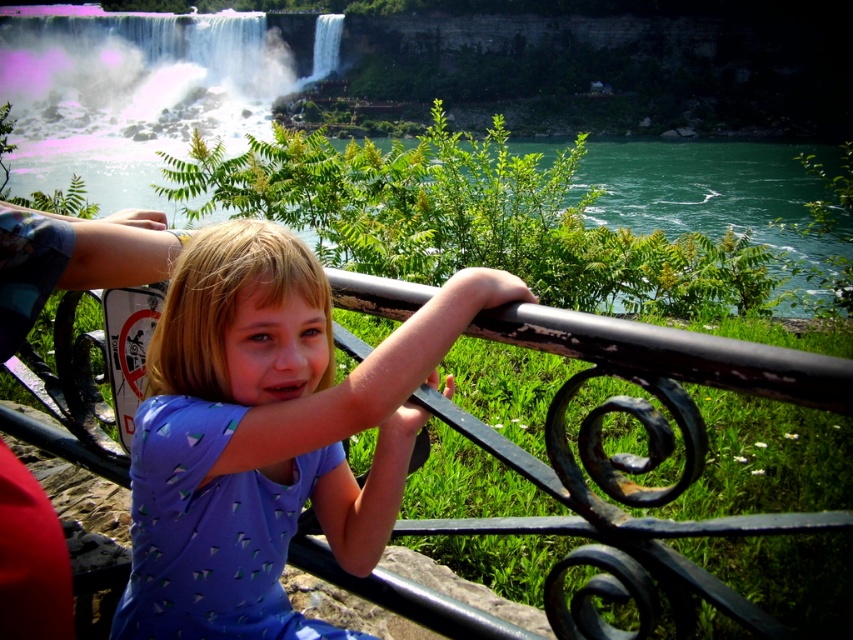
Which is more to the right, purple matte shirt at center or green water at upper center?

purple matte shirt at center

What do you see at coordinates (267, 433) in the screenshot?
I see `purple matte shirt at center` at bounding box center [267, 433].

Is point (204, 300) farther from viewer compared to point (585, 157)?

No, (204, 300) is closer to viewer.

Find the location of a particular element. purple matte shirt at center is located at coordinates (267, 433).

Locate an element on the screen. This screenshot has height=640, width=853. purple matte shirt at center is located at coordinates (267, 433).

Can you confirm if purple matte shirt at center is positioned below white frothy water at upper left?

Yes, purple matte shirt at center is below white frothy water at upper left.

What are the coordinates of `purple matte shirt at center` in the screenshot? It's located at (267, 433).

Who is shorter, green water at upper center or white frothy water at upper left?

With less height is green water at upper center.

Which is below, green water at upper center or white frothy water at upper left?

green water at upper center

Describe the element at coordinates (549, 216) in the screenshot. The width and height of the screenshot is (853, 640). I see `green water at upper center` at that location.

Image resolution: width=853 pixels, height=640 pixels. Find the location of `green water at upper center`. green water at upper center is located at coordinates (549, 216).